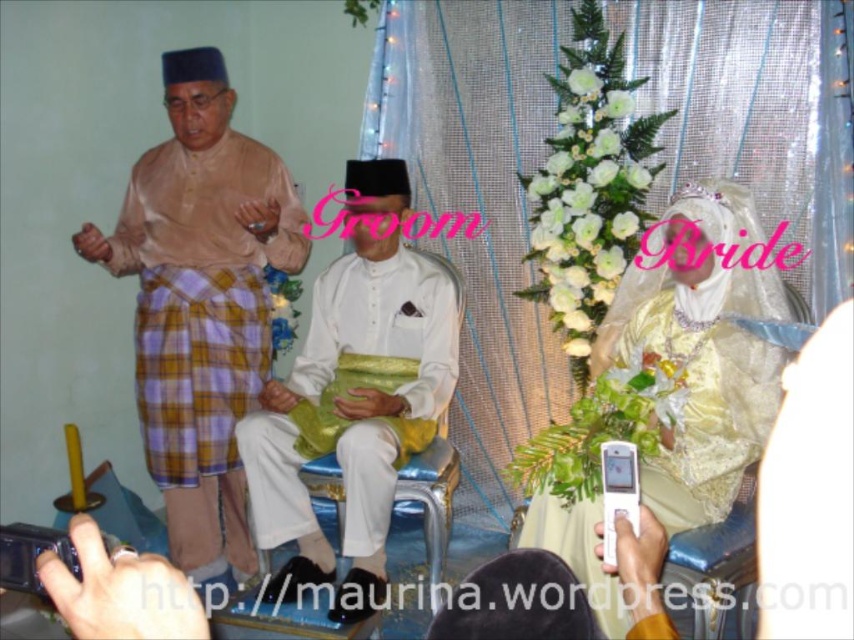
Is matte brown shirt at left wider than white satin dress at upper right?

Incorrect, matte brown shirt at left's width does not surpass white satin dress at upper right's.

Who is more distant from viewer, [196,200] or [630,346]?

The point [196,200] is more distant.

Locate an element on the screen. The height and width of the screenshot is (640, 854). matte brown shirt at left is located at coordinates (202, 301).

Measure the distance between white satin shirt at center and white satin dress at upper right.

white satin shirt at center and white satin dress at upper right are 29.27 inches apart from each other.

Describe the element at coordinates (354, 396) in the screenshot. I see `white satin shirt at center` at that location.

Image resolution: width=854 pixels, height=640 pixels. I want to click on white satin shirt at center, so click(x=354, y=396).

Does matte brown shirt at left have a lesser width compared to white satin shirt at center?

Yes, matte brown shirt at left is thinner than white satin shirt at center.

Describe the element at coordinates (202, 301) in the screenshot. I see `matte brown shirt at left` at that location.

Which is in front, point (171, 112) or point (372, 394)?

Point (372, 394) is more forward.

In order to click on matte brown shirt at left in this screenshot , I will do `click(202, 301)`.